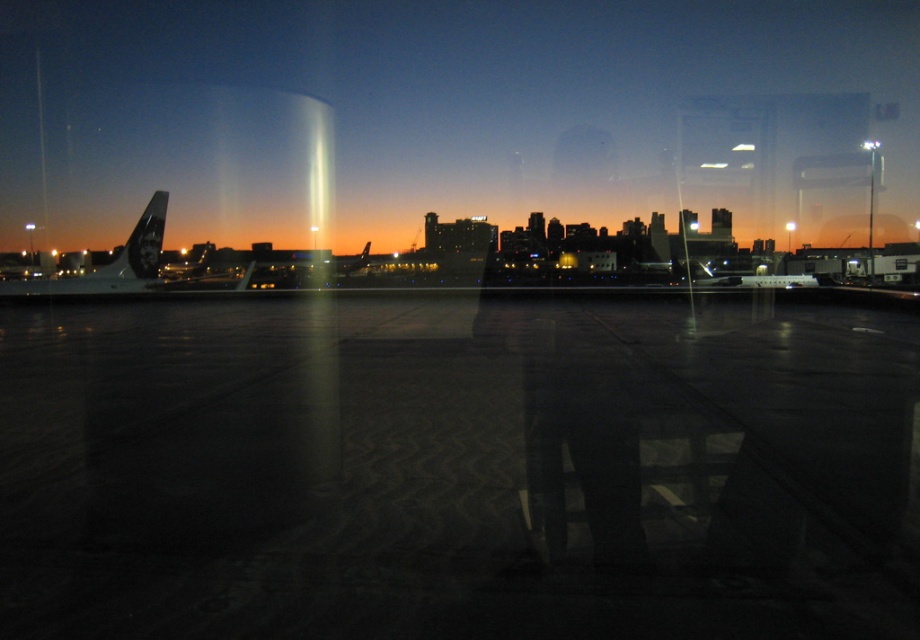
Question: Does white matte airplane at left have a smaller size compared to metallic silver airplane at center?

Choices:
 (A) yes
 (B) no

Answer: (A)

Question: Which point is closer to the camera taking this photo?

Choices:
 (A) (128, 250)
 (B) (696, 280)

Answer: (A)

Question: Is white matte airplane at left thinner than metallic silver airplane at center?

Choices:
 (A) no
 (B) yes

Answer: (B)

Question: Does white matte airplane at left have a smaller size compared to metallic silver airplane at center?

Choices:
 (A) yes
 (B) no

Answer: (A)